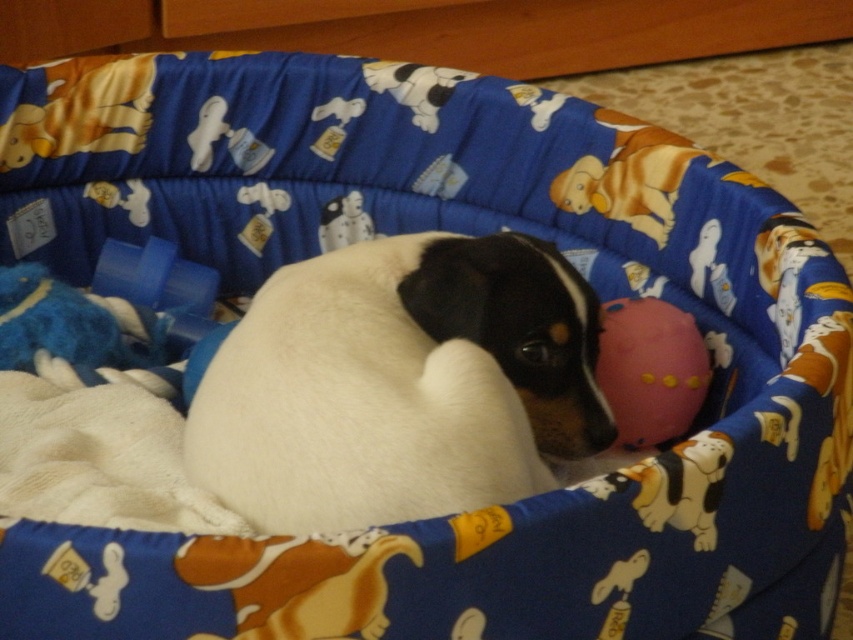
Question: Which of the following is the farthest from the observer?

Choices:
 (A) white fur dog at center
 (B) pink rubber ball at center

Answer: (B)

Question: Can you confirm if white fur dog at center is smaller than pink rubber ball at center?

Choices:
 (A) no
 (B) yes

Answer: (A)

Question: Does white fur dog at center appear on the right side of pink rubber ball at center?

Choices:
 (A) no
 (B) yes

Answer: (A)

Question: Among these points, which one is farthest from the camera?

Choices:
 (A) pyautogui.click(x=363, y=328)
 (B) pyautogui.click(x=634, y=433)

Answer: (B)

Question: Can you confirm if white fur dog at center is positioned above pink rubber ball at center?

Choices:
 (A) yes
 (B) no

Answer: (A)